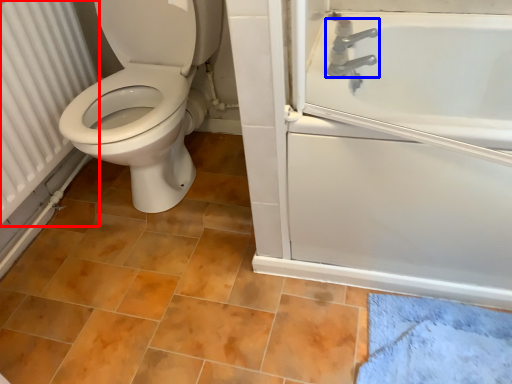
Question: Which object appears farthest to the camera in this image, radiator (highlighted by a red box) or tap (highlighted by a blue box)?

Choices:
 (A) radiator
 (B) tap

Answer: (B)